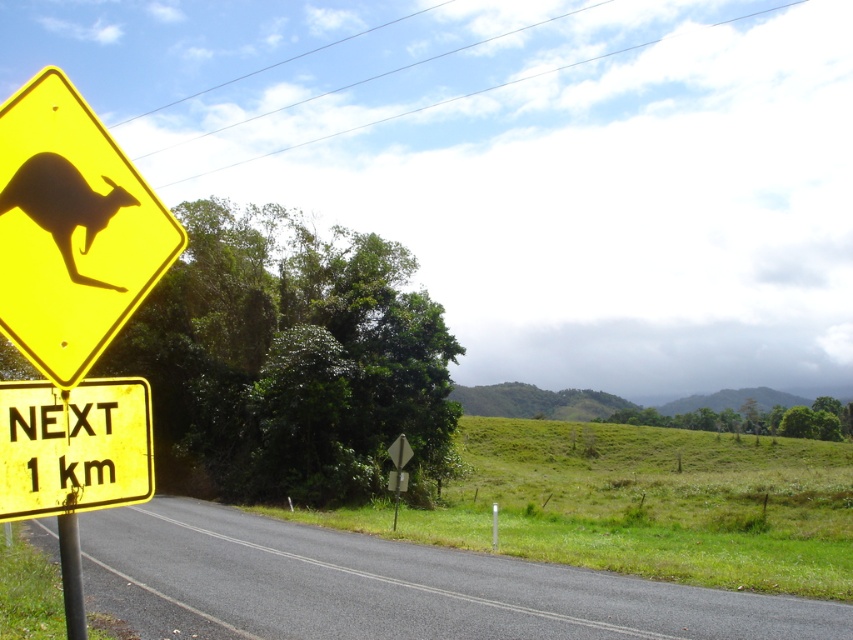
Is silhouette paper kangaroo at left to the left of metallic pole at left from the viewer's perspective?

In fact, silhouette paper kangaroo at left is to the right of metallic pole at left.

In the scene shown: Is silhouette paper kangaroo at left smaller than metallic pole at left?

No, silhouette paper kangaroo at left is not smaller than metallic pole at left.

Is point (64, 218) less distant than point (71, 627)?

Yes.

This screenshot has height=640, width=853. I want to click on silhouette paper kangaroo at left, so click(x=62, y=205).

Is point (9, 102) behind point (67, 538)?

No, (9, 102) is in front of (67, 538).

Does yellow plastic kangaroo sign at left have a lesser height compared to metallic pole at left?

No, yellow plastic kangaroo sign at left is not shorter than metallic pole at left.

This screenshot has width=853, height=640. What do you see at coordinates (71, 228) in the screenshot?
I see `yellow plastic kangaroo sign at left` at bounding box center [71, 228].

You are a GUI agent. You are given a task and a screenshot of the screen. Output one action in this format:
    pyautogui.click(x=<x>, y=<y>)
    Task: Click on the yellow plastic kangaroo sign at left
    
    Given the screenshot: What is the action you would take?
    pyautogui.click(x=71, y=228)

Between point (59, 145) and point (67, 182), which one is positioned in front?

Point (59, 145) is more forward.

Which is below, yellow plastic kangaroo sign at left or silhouette paper kangaroo at left?

silhouette paper kangaroo at left is lower down.

The width and height of the screenshot is (853, 640). In order to click on yellow plastic kangaroo sign at left in this screenshot , I will do click(71, 228).

Where is `yellow plastic kangaroo sign at left`? yellow plastic kangaroo sign at left is located at coordinates (71, 228).